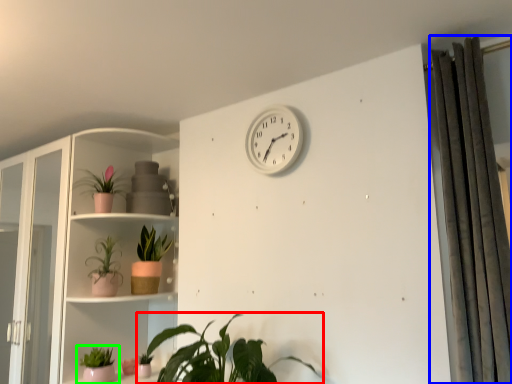
Question: Which is nearer to the houseplant (highlighted by a red box)? curtain (highlighted by a blue box) or houseplant (highlighted by a green box).

Choices:
 (A) curtain
 (B) houseplant

Answer: (B)